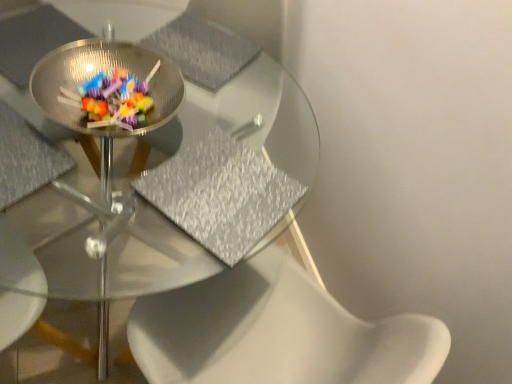
Question: From a real-world perspective, is metallic silver chair at center positioned over transparent glass table at center based on gravity?

Choices:
 (A) no
 (B) yes

Answer: (B)

Question: From a real-world perspective, is metallic silver chair at center beneath transparent glass table at center?

Choices:
 (A) yes
 (B) no

Answer: (B)

Question: Considering the relative sizes of metallic silver chair at center and transparent glass table at center in the image provided, is metallic silver chair at center smaller than transparent glass table at center?

Choices:
 (A) no
 (B) yes

Answer: (B)

Question: Considering the relative sizes of metallic silver chair at center and transparent glass table at center in the image provided, is metallic silver chair at center taller than transparent glass table at center?

Choices:
 (A) no
 (B) yes

Answer: (A)

Question: Considering the relative positions of metallic silver chair at center and transparent glass table at center in the image provided, is metallic silver chair at center to the right of transparent glass table at center from the viewer's perspective?

Choices:
 (A) no
 (B) yes

Answer: (A)

Question: Can you confirm if metallic silver chair at center is bigger than transparent glass table at center?

Choices:
 (A) yes
 (B) no

Answer: (B)

Question: From the image's perspective, is metallic silver chair at center located beneath clear glass bowl at center?

Choices:
 (A) yes
 (B) no

Answer: (A)

Question: Is metallic silver chair at center beside clear glass bowl at center?

Choices:
 (A) no
 (B) yes

Answer: (A)

Question: Is metallic silver chair at center shorter than clear glass bowl at center?

Choices:
 (A) yes
 (B) no

Answer: (A)

Question: Is metallic silver chair at center wider than clear glass bowl at center?

Choices:
 (A) no
 (B) yes

Answer: (A)

Question: Can we say metallic silver chair at center lies outside clear glass bowl at center?

Choices:
 (A) no
 (B) yes

Answer: (B)

Question: From a real-world perspective, does metallic silver chair at center stand above clear glass bowl at center?

Choices:
 (A) yes
 (B) no

Answer: (B)

Question: From a real-world perspective, is clear glass bowl at center located higher than metallic silver chair at center?

Choices:
 (A) yes
 (B) no

Answer: (A)